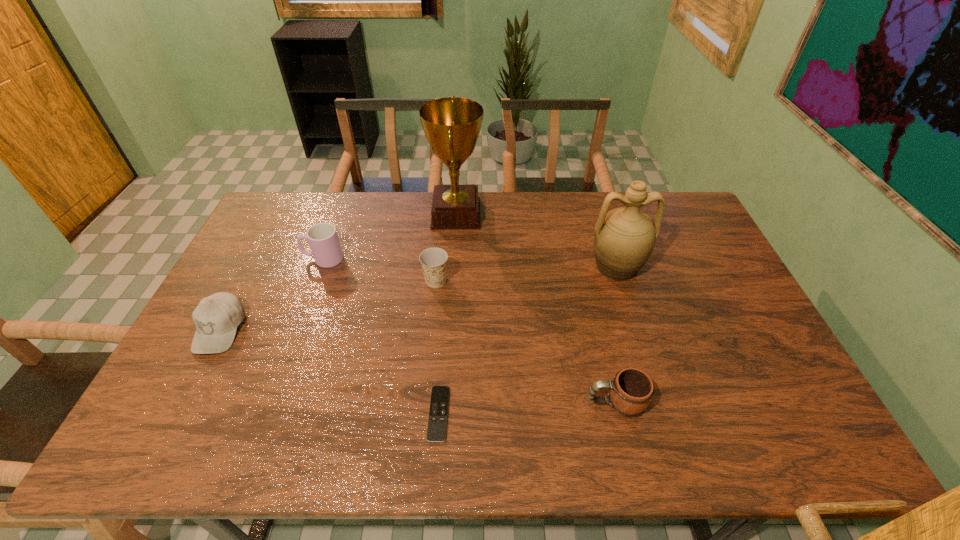
You are a GUI agent. You are given a task and a screenshot of the screen. Output one action in this format:
    pyautogui.click(x=<x>, y=<y>)
    Task: Click on the empty space that is in between the remote control and the sixth object from right to left
    The image size is (960, 540).
    Given the screenshot: What is the action you would take?
    pyautogui.click(x=381, y=336)

Find the location of a particular element. Image resolution: width=960 pixels, height=540 pixels. free space between the leftmost object and the award is located at coordinates coord(338,272).

Find the location of a particular element. The image size is (960, 540). vacant area that lies between the shortest object and the Dixie cup is located at coordinates (437, 347).

At what (x,y) coordinates should I click in order to perform the action: click on unoccupied area between the fifth farthest object and the remote control. Please return your answer as a coordinate pair (x, y). Looking at the image, I should click on (329, 372).

This screenshot has width=960, height=540. I want to click on free space between the mug and the shortest object, so coord(527,408).

The image size is (960, 540). Identify the location of vacant space in between the second object from left to right and the farthest object. 390,237.

Identify the location of vacant space that is in between the cup and the tallest object. The width and height of the screenshot is (960, 540). (x=390, y=237).

At what (x,y) coordinates should I click in order to perform the action: click on vacant area that lies between the award and the Dixie cup. Please return your answer as a coordinate pair (x, y). The height and width of the screenshot is (540, 960). Looking at the image, I should click on (446, 248).

Image resolution: width=960 pixels, height=540 pixels. Identify the location of vacant area that lies between the pitcher and the second object from left to right. (469, 262).

Identify the location of object that stands as the fourth closest to the cup. (437, 424).